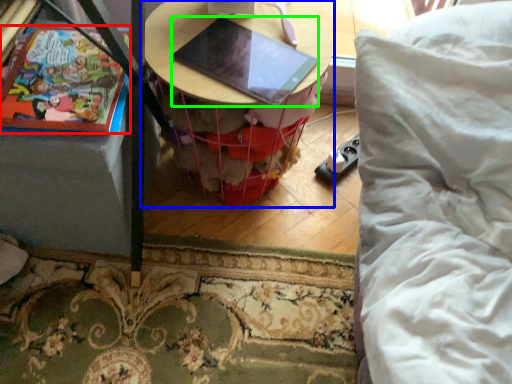
Question: Considering the real-world distances, which object is farthest from comic book (highlighted by a red box)? table (highlighted by a blue box) or laptop (highlighted by a green box)?

Choices:
 (A) table
 (B) laptop

Answer: (A)